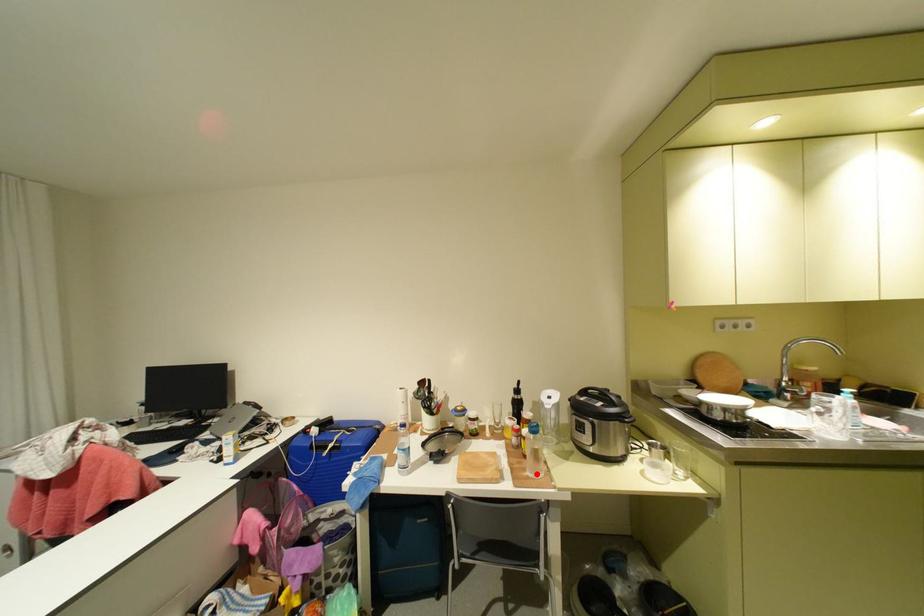
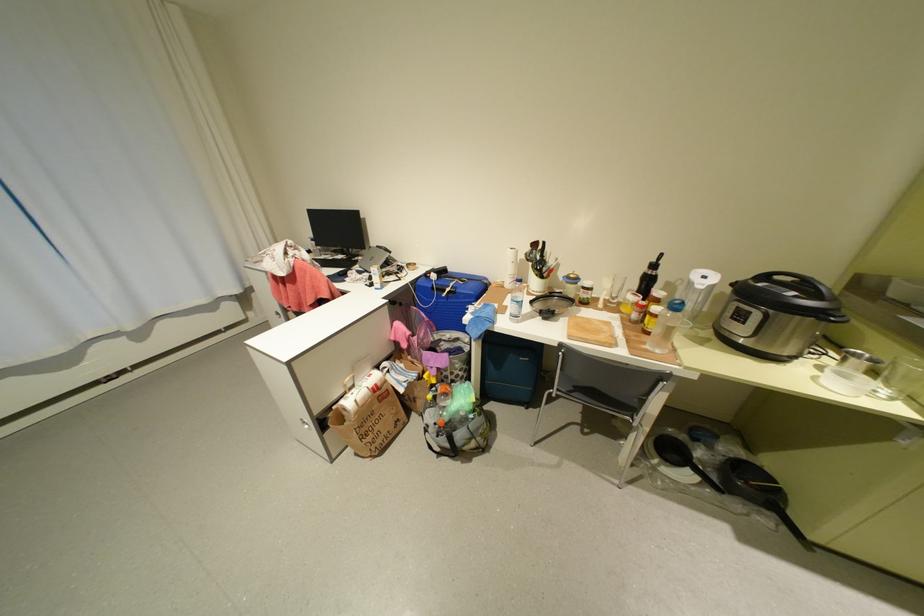
Question: I am providing you with two images of the same scene from different viewpoints. A red point is marked on the first image. Can you still see the location of the red point in image 2?

Choices:
 (A) Yes
 (B) No

Answer: (A)